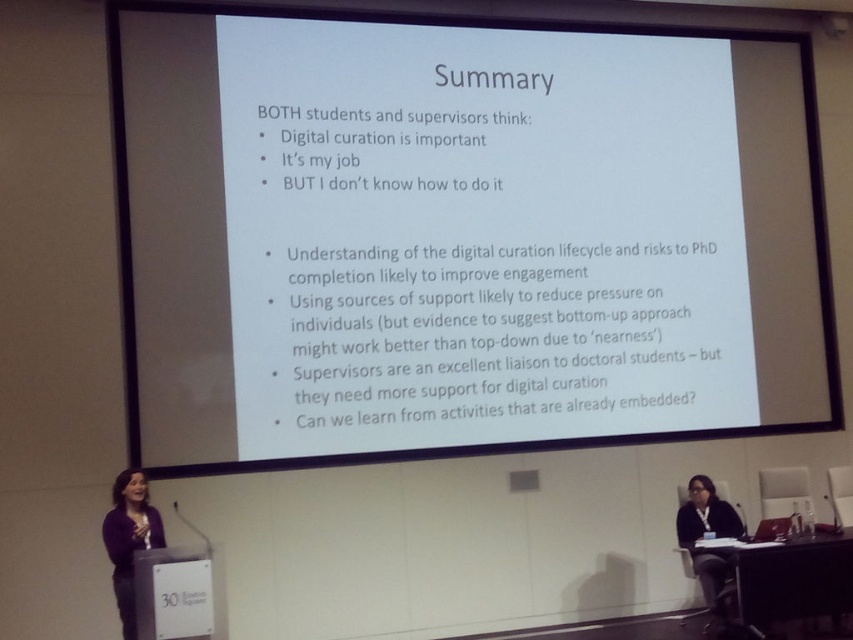
Question: Among these objects, which one is farthest from the camera?

Choices:
 (A) dark purple sweater at lower left
 (B) black fabric at lower right

Answer: (B)

Question: Does dark purple sweater at lower left appear over black fabric at lower right?

Choices:
 (A) yes
 (B) no

Answer: (A)

Question: Can you confirm if dark purple sweater at lower left is positioned to the left of black fabric at lower right?

Choices:
 (A) yes
 (B) no

Answer: (A)

Question: Can you confirm if dark purple sweater at lower left is positioned to the left of black fabric at lower right?

Choices:
 (A) no
 (B) yes

Answer: (B)